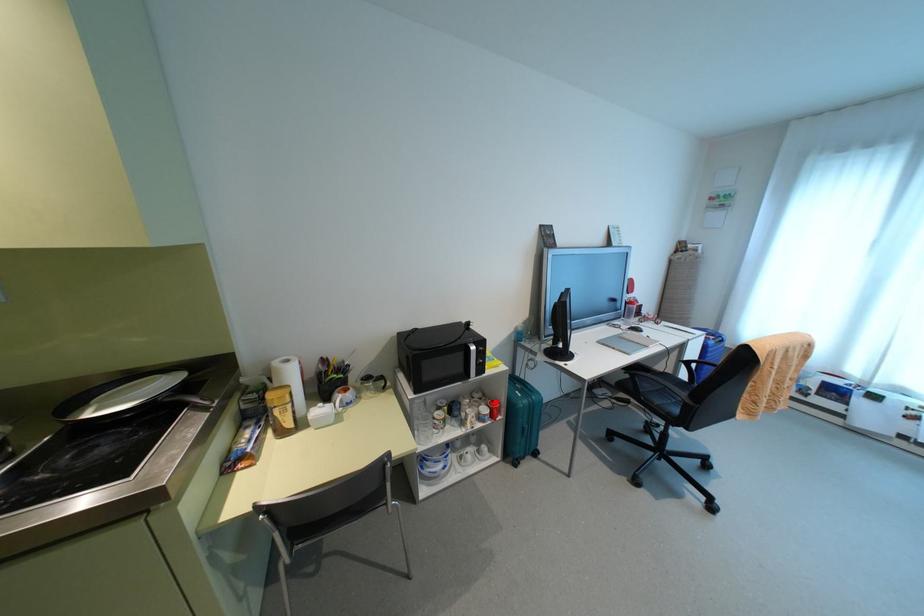
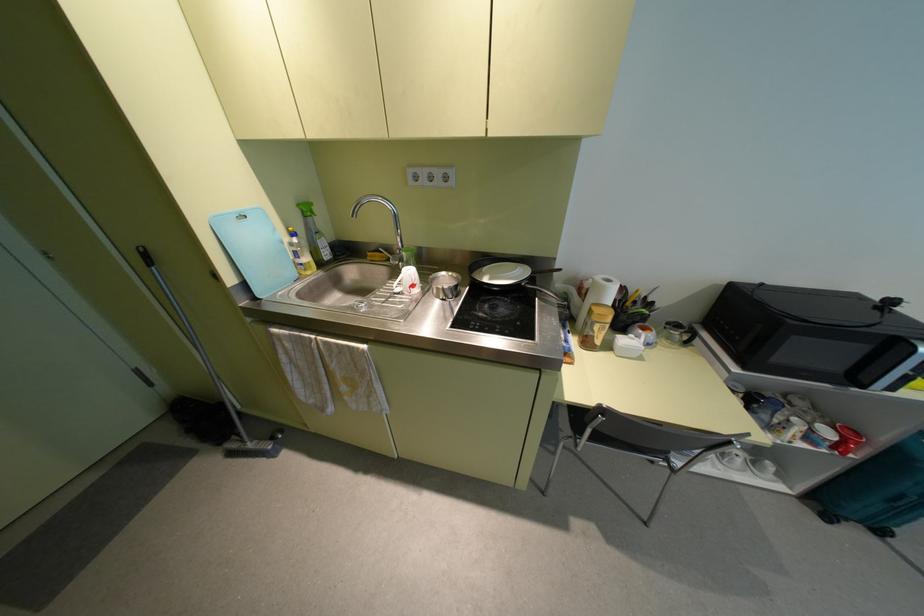
Find the pixel in the second image that matches the highlighted location in the first image.

(857, 434)